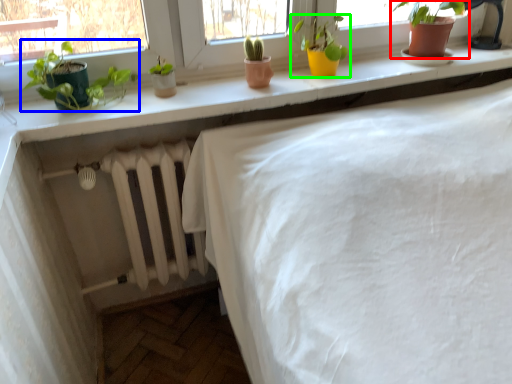
Question: Estimate the real-world distances between objects in this image. Which object is farther from houseplant (highlighted by a red box), houseplant (highlighted by a blue box) or houseplant (highlighted by a green box)?

Choices:
 (A) houseplant
 (B) houseplant

Answer: (A)